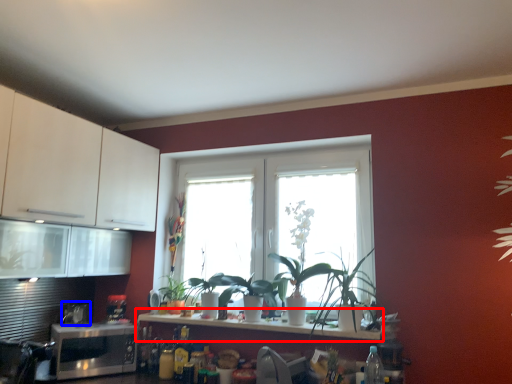
Question: Among these objects, which one is nearest to the camera, countertop (highlighted by a red box) or appliance (highlighted by a blue box)?

Choices:
 (A) countertop
 (B) appliance

Answer: (A)